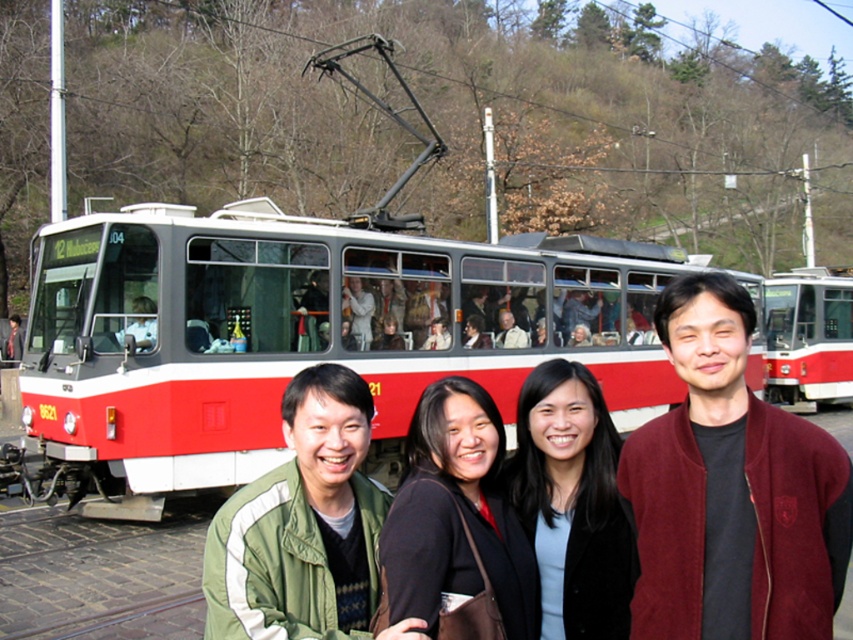
You are a photographer trying to capture a photo of the group in front of the tram. You notice the burgundy suede jacket at right and the black fabric at center. Which clothing item is located more to the right side of the group?

The burgundy suede jacket at right is positioned on the right side of the black fabric at center, so it is more to the right.

You are a photographer adjusting your camera settings to focus on two points in the scene. The first point is at coordinates point (241, 621), and the second point is at point (550, 508). Which point should you focus on first to ensure the closest object is sharp?

You should focus on point (241, 621) first because it is closer to the camera than point (550, 508).